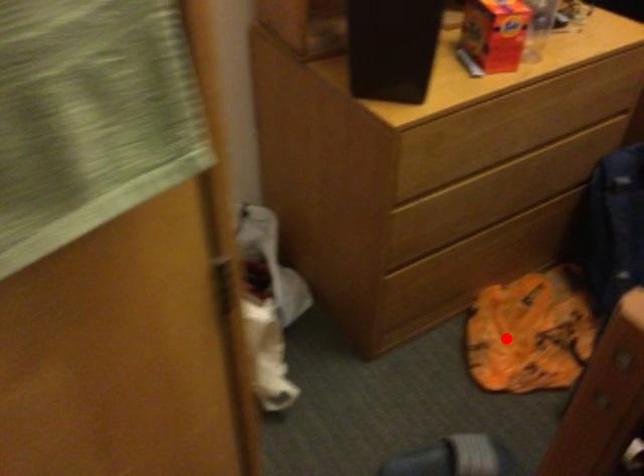
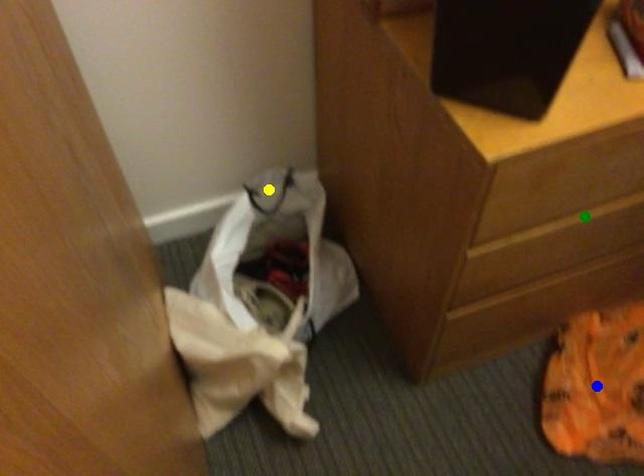
Question: I am providing you with two images of the same scene from different viewpoints. A red point is marked on the first image. You are given multiple points on the second image. Which mark in image 2 goes with the point in image 1?

Choices:
 (A) green point
 (B) blue point
 (C) yellow point

Answer: (B)